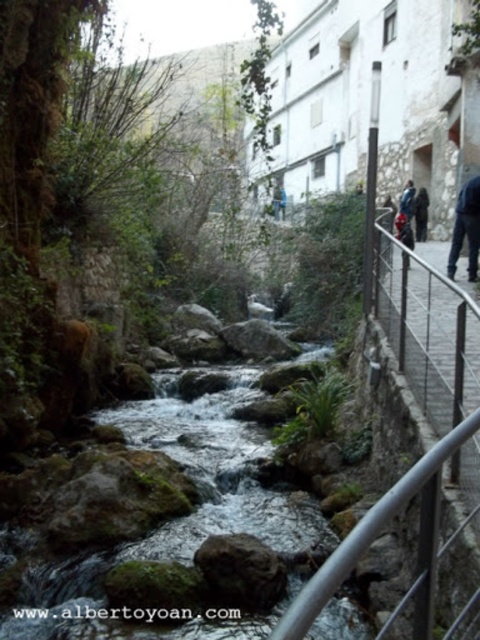
Question: Is dark blue jeans at right below blue fabric jacket at upper center?

Choices:
 (A) yes
 (B) no

Answer: (A)

Question: Which point appears farthest from the camera in this image?

Choices:
 (A) [468, 205]
 (B) [417, 209]

Answer: (B)

Question: Is dark blue jeans at right thinner than blue fabric jacket at upper center?

Choices:
 (A) no
 (B) yes

Answer: (B)

Question: Can you confirm if dark blue jeans at right is positioned above blue fabric jacket at upper center?

Choices:
 (A) no
 (B) yes

Answer: (A)

Question: Which of the following is the closest to the observer?

Choices:
 (A) (420, 236)
 (B) (469, 268)

Answer: (B)